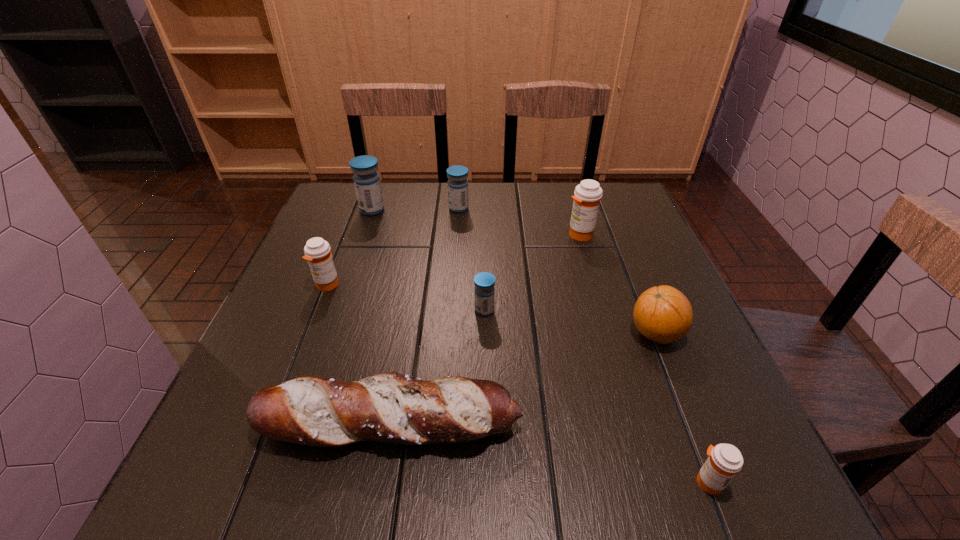
At what (x,y) coordinates should I click in order to perform the action: click on the third farthest object. Please return your answer as a coordinate pair (x, y). Image resolution: width=960 pixels, height=540 pixels. Looking at the image, I should click on (587, 195).

At what (x,y) coordinates should I click in order to perform the action: click on the sixth object from left to right. Please return your answer as a coordinate pair (x, y). Image resolution: width=960 pixels, height=540 pixels. Looking at the image, I should click on (587, 195).

The width and height of the screenshot is (960, 540). I want to click on the biggest blue medicine, so click(x=366, y=180).

At what (x,y) coordinates should I click in order to perform the action: click on the second biggest blue medicine. Please return your answer as a coordinate pair (x, y). Looking at the image, I should click on (457, 184).

Where is `the third medicine from left to right`? The width and height of the screenshot is (960, 540). the third medicine from left to right is located at coordinates (457, 184).

Where is `the fourth farthest medicine`? This screenshot has width=960, height=540. the fourth farthest medicine is located at coordinates (317, 252).

Identify the location of the second nearest orange medicine. This screenshot has height=540, width=960. (317, 252).

Where is `orange`? This screenshot has height=540, width=960. orange is located at coordinates (663, 314).

Where is `the second nearest object`? the second nearest object is located at coordinates (393, 408).

Where is `the third medicine from right to left`? the third medicine from right to left is located at coordinates (484, 292).